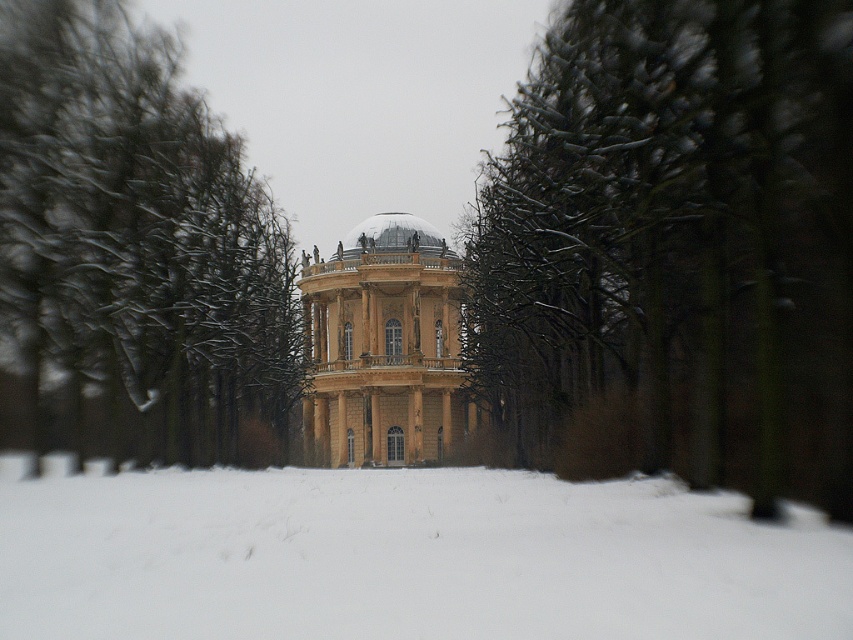
You are standing at the entrance of the grand classical building and want to place a decorative snowman exactly at the center of the white fluffy snow at lower center. According to the coordinates provided, where should you position the snowman?

The white fluffy snow at lower center is located at point (405, 556), so you should position the snowman at those coordinates to place it exactly at the center of the white fluffy snow at lower center.

Based on the photo, you are standing at the entrance of the grand classical building and looking towards the snow. Where is the point located at coordinates point (138, 244)?

The point at coordinates point (138, 244) is located at the snow covered branches at left.